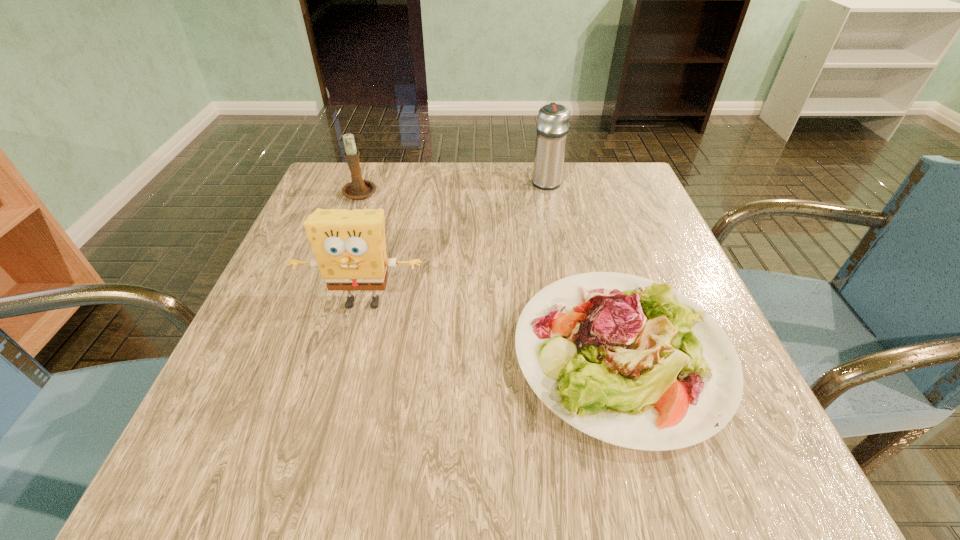
In the image, there is a desktop. Where is `blank space at the far left corner`? This screenshot has width=960, height=540. blank space at the far left corner is located at coordinates (309, 202).

In the image, there is a desktop. At what (x,y) coordinates should I click in order to perform the action: click on vacant space at the near left corner. Please return your answer as a coordinate pair (x, y). Image resolution: width=960 pixels, height=540 pixels. Looking at the image, I should click on (280, 436).

Where is `vacant region at the far right corner of the desktop`? The image size is (960, 540). vacant region at the far right corner of the desktop is located at coordinates (602, 208).

I want to click on free point between the candle holder and the shortest object, so click(x=492, y=272).

Image resolution: width=960 pixels, height=540 pixels. Identify the location of free spot between the shortest object and the sponge. (492, 328).

Locate an element on the screen. free spot between the candle holder and the thermos bottle is located at coordinates (453, 186).

Locate an element on the screen. The height and width of the screenshot is (540, 960). free area in between the thermos bottle and the second shortest object is located at coordinates (453, 186).

Where is `free space that is in between the salad plate and the candle holder`? The image size is (960, 540). free space that is in between the salad plate and the candle holder is located at coordinates (492, 272).

Locate an element on the screen. This screenshot has width=960, height=540. vacant space in between the sponge and the thermos bottle is located at coordinates (455, 241).

What are the coordinates of `free spot between the shortest object and the sponge` in the screenshot? It's located at (492, 328).